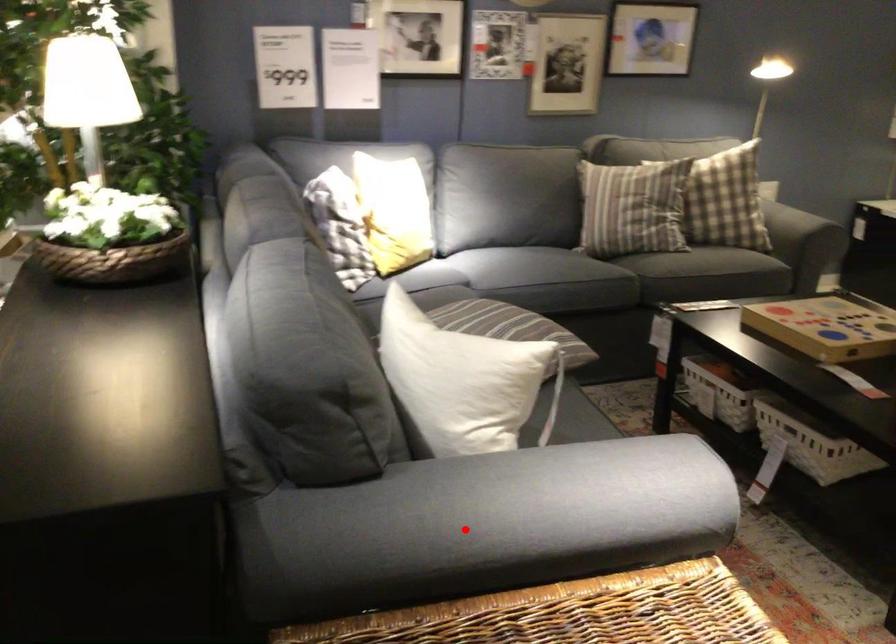
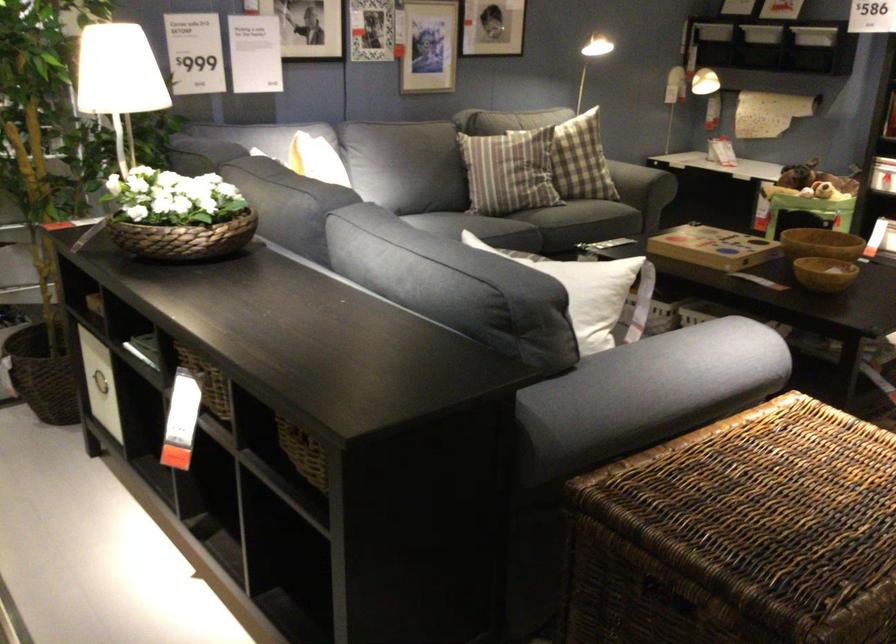
Find the pixel in the second image that matches the highlighted location in the first image.

(647, 393)